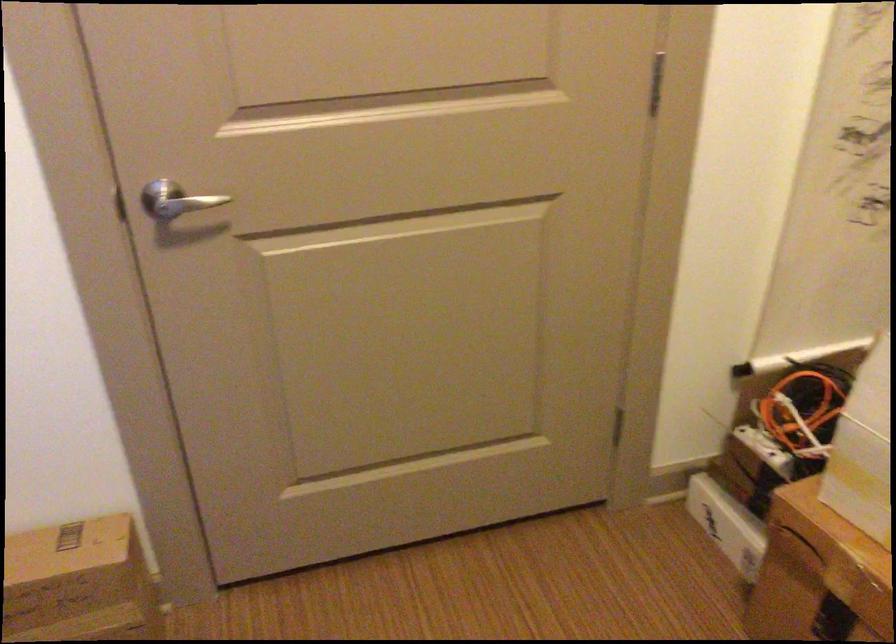
Where would you pull the silver door handle? Please return your answer as a coordinate pair (x, y).

(176, 200)